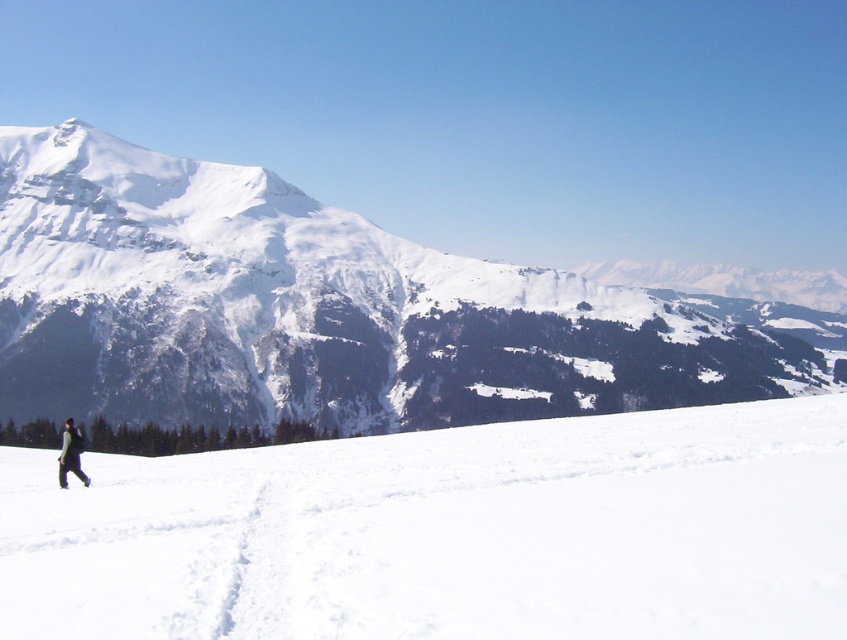
Question: Which object is the farthest from the white snow-covered mountain at left?

Choices:
 (A) dark green jacket at lower left
 (B) white snow at lower left

Answer: (B)

Question: Which point appears farthest from the camera in this image?

Choices:
 (A) click(646, 404)
 (B) click(72, 461)
 (C) click(510, 566)

Answer: (A)

Question: Considering the real-world distances, which object is closest to the black matte ski at lower left?

Choices:
 (A) white snow-covered mountain at left
 (B) dark green jacket at lower left
 (C) white snow at lower left

Answer: (B)

Question: Is white snow at lower left smaller than black matte ski at lower left?

Choices:
 (A) yes
 (B) no

Answer: (B)

Question: Does dark green jacket at lower left have a greater width compared to black matte ski at lower left?

Choices:
 (A) no
 (B) yes

Answer: (B)

Question: Does white snow-covered mountain at left have a larger size compared to black matte ski at lower left?

Choices:
 (A) no
 (B) yes

Answer: (B)